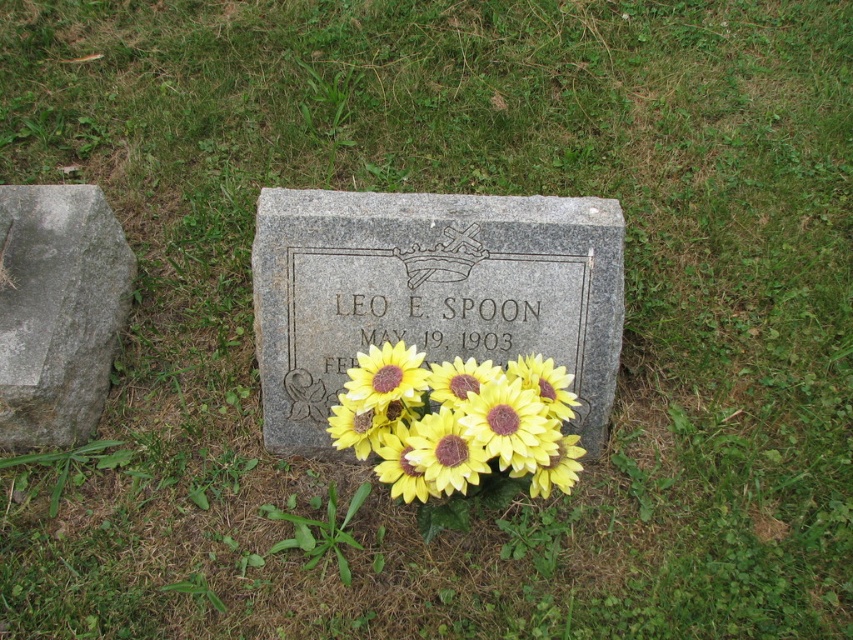
You are a gardener who wants to plant a new flower bed near the gray rough stone at left and the yellow matte sunflower at center. Considering their sizes, which one should you place closer to the path to avoid blocking the view?

The gray rough stone at left is larger in size than the yellow matte sunflower at center, so you should place the gray rough stone at left farther from the path and the yellow matte sunflower at center closer to the path to avoid blocking the view.

You are a florist who just delivered a yellow matte sunflower at center to the granite gravestone at center. You want to place the sunflower so it is visible from the main path that runs along the left side of the cemetery. Which object should you place closer to the path?

The yellow matte sunflower at center should be placed closer to the path so it can be seen from the main path on the left side, as it is shorter than the granite gravestone at center and would be more visible when positioned nearer to the path.

You are standing in a cemetery and see the granite gravestone at center and the gray rough stone at left. Which one takes up more space in the image?

The gray rough stone at left takes up more space in the image because the granite gravestone at center occupies less space than gray rough stone at left according to the description.